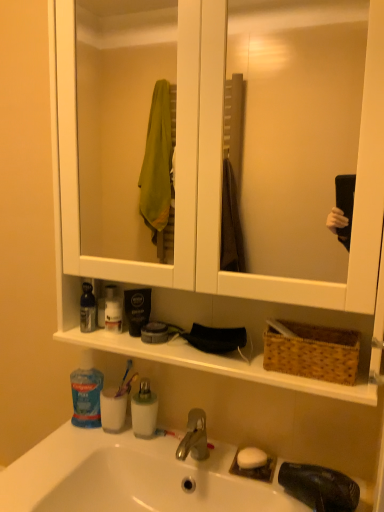
This screenshot has width=384, height=512. Find the location of `free location to the left of white plastic toothbrush at center, the second toothbrush when ordered from back to front`. free location to the left of white plastic toothbrush at center, the second toothbrush when ordered from back to front is located at coordinates (128, 445).